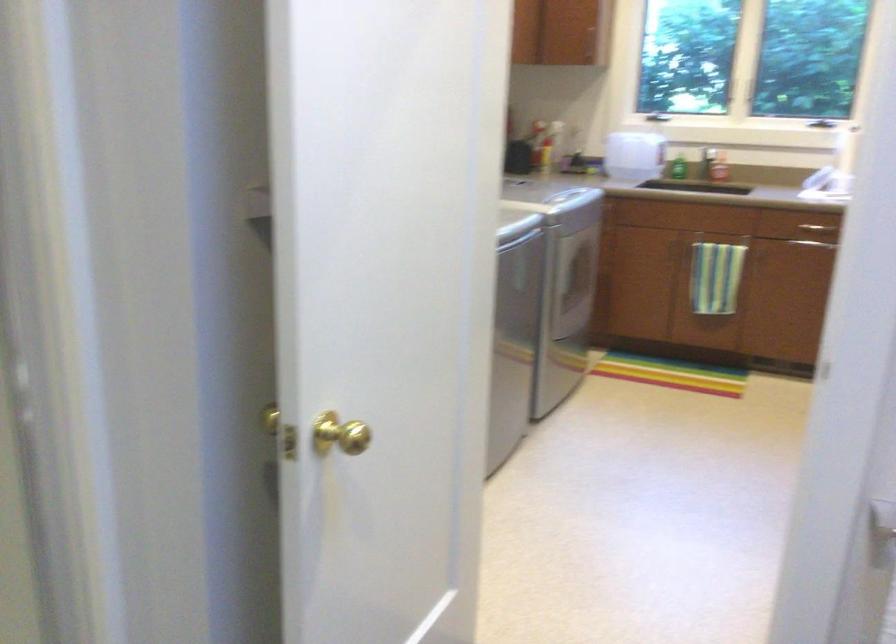
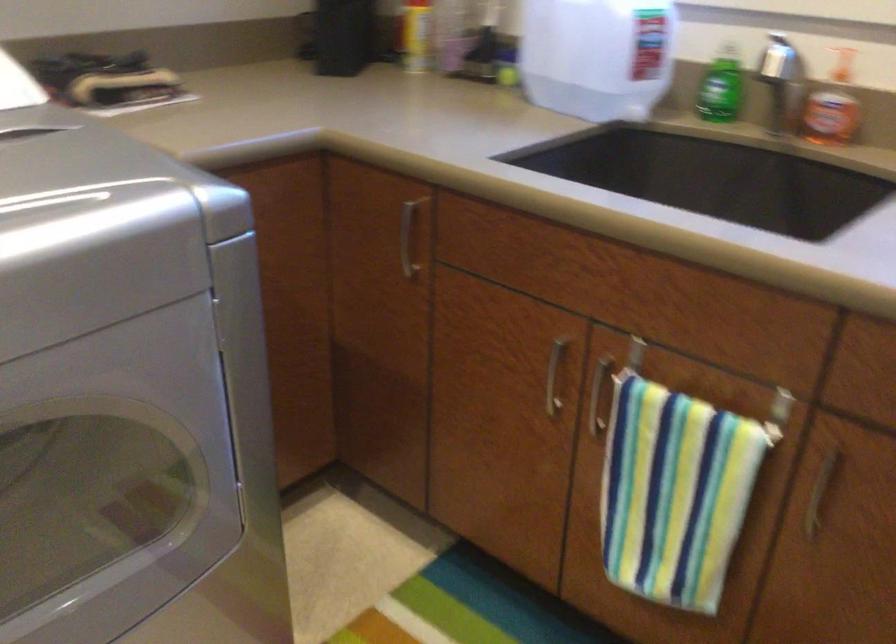
The point at (760,261) is marked in the first image. Where is the corresponding point in the second image?

(819, 494)